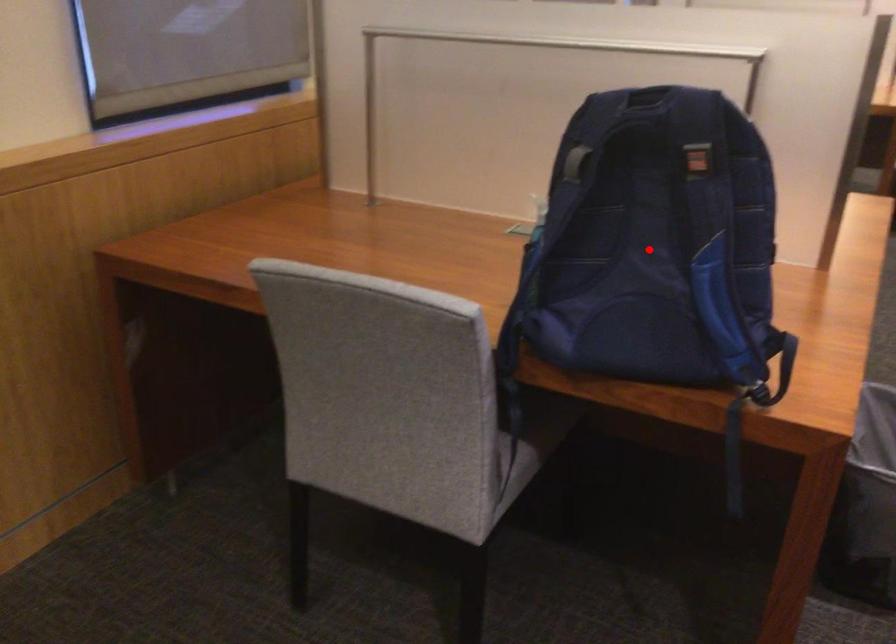
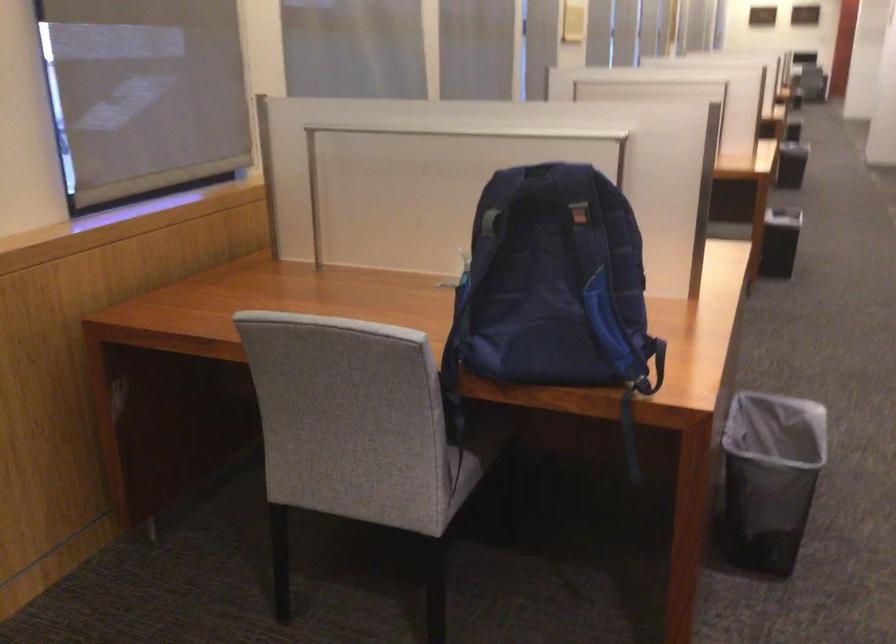
Question: I am providing you with two images of the same scene from different viewpoints. Given a red point in image1, look at the same physical point in image2. Is it:

Choices:
 (A) Closer to the viewpoint
 (B) Farther from the viewpoint

Answer: (B)